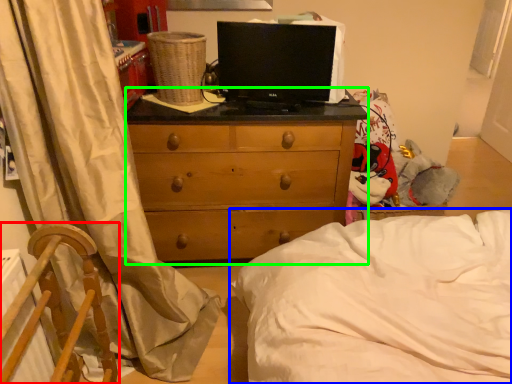
Question: Based on their relative distances, which object is nearer to furniture (highlighted by a red box)? Choose from bed (highlighted by a blue box) and chest of drawers (highlighted by a green box).

Choices:
 (A) bed
 (B) chest of drawers

Answer: (A)